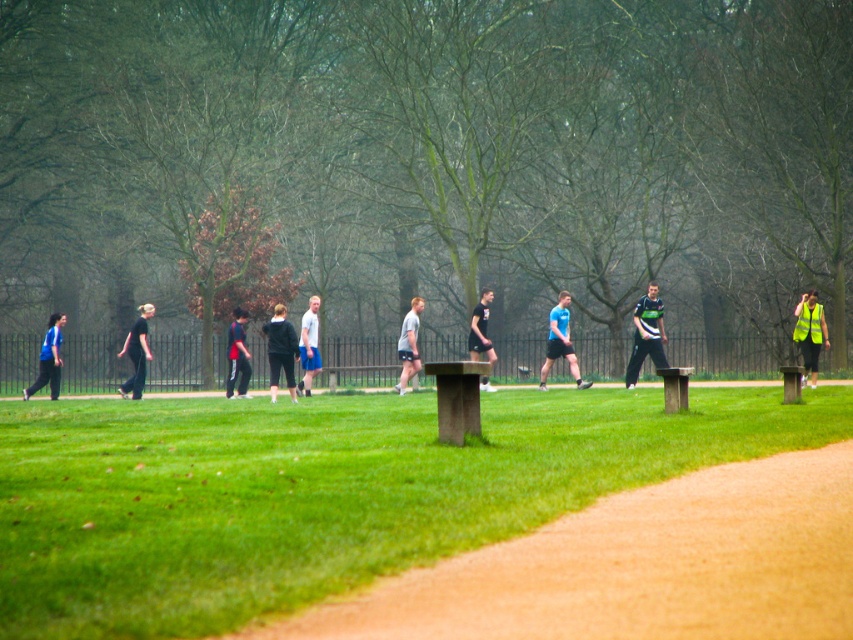
Who is shorter, blue fabric shirt at center or light blue shorts at center?

light blue shorts at center is shorter.

Based on the photo, can you confirm if blue fabric shirt at center is positioned below light blue shorts at center?

Actually, blue fabric shirt at center is above light blue shorts at center.

Where is `blue fabric shirt at center`? This screenshot has width=853, height=640. blue fabric shirt at center is located at coordinates [x=560, y=342].

Does dark blue jacket at center have a lesser height compared to light blue shorts at center?

Yes, dark blue jacket at center is shorter than light blue shorts at center.

Between dark blue jacket at center and light blue shorts at center, which one appears on the right side from the viewer's perspective?

Positioned to the right is light blue shorts at center.

Between point (248, 378) and point (305, 312), which one is positioned in front?

Point (305, 312) is more forward.

This screenshot has height=640, width=853. What are the coordinates of `dark blue jacket at center` in the screenshot? It's located at (236, 355).

Is green grass at center bigger than black fabric pants at left?

Actually, green grass at center might be smaller than black fabric pants at left.

What do you see at coordinates (322, 492) in the screenshot? I see `green grass at center` at bounding box center [322, 492].

Does point (762, 413) come in front of point (135, 364)?

Yes, it is in front of point (135, 364).

This screenshot has height=640, width=853. I want to click on green grass at center, so click(x=322, y=492).